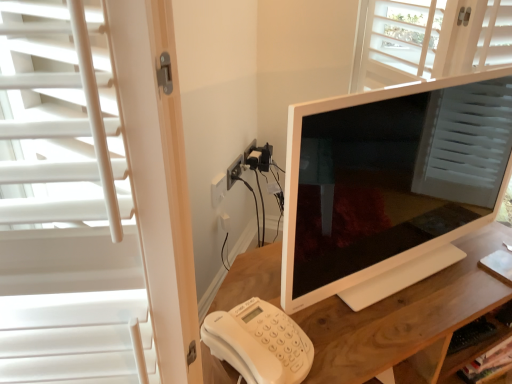
Identify the location of vacant point to the right of white plastic phone at lower left. (344, 334).